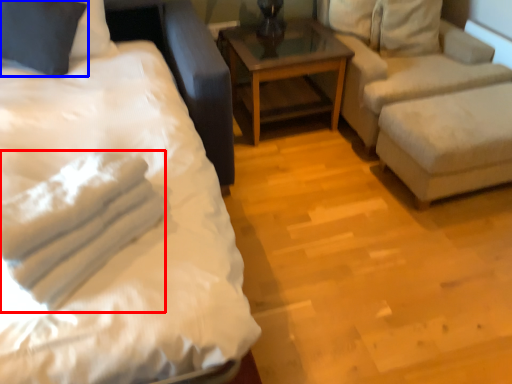
Question: Which point is closer to the camera, material (highlighted by a red box) or pillow (highlighted by a blue box)?

Choices:
 (A) material
 (B) pillow

Answer: (A)